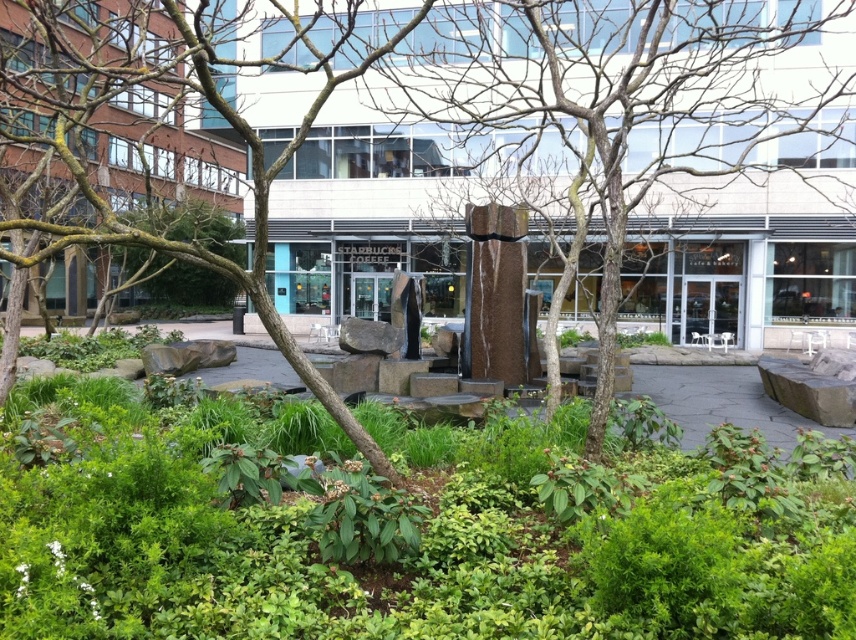
You are standing in the urban park and want to take a photo of the Starbucks Coffee shop in the background without any obstructions. Are the bare branches at center blocking your view of the Starbucks Coffee shop?

The bare branches at center are located at point (608, 113), which is in the foreground. Since the Starbucks Coffee shop is in the background, the branches might be blocking the view depending on their position. However, without specific spatial relation details between the branches and the Starbucks, it is uncertain. Please provide more information about their relative positions.

You are a landscape architect planning to install a new bench in the park. You want to place it exactly halfway between the bare branches at center and the polished bronze statue at center. How far apart should the bench be placed from each object?

The bench should be placed 3.255 meters away from both the bare branches at center and the polished bronze statue at center since they are 6.51 meters apart.

From the picture: You are standing at the point with coordinates point [411,301] and want to walk to the point with coordinates point [528,140]. Will the building in the background block your path?

Point [528,140] is behind point [411,301], so the building in the background will block your path to point [528,140].